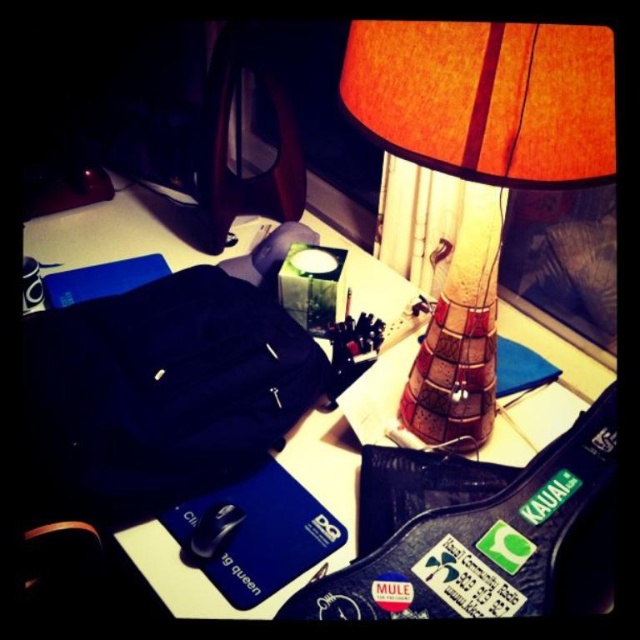
Does matte black backpack at center come behind white paper at upper center?

That is False.

Who is more distant from viewer, (x=236, y=339) or (x=384, y=417)?

Positioned behind is point (x=384, y=417).

This screenshot has height=640, width=640. What are the coordinates of `matte black backpack at center` in the screenshot? It's located at (164, 387).

Is point (433, 35) farther from viewer compared to point (102, 442)?

No, it is not.

Where is `orange fabric lampshade at upper right`? The height and width of the screenshot is (640, 640). orange fabric lampshade at upper right is located at coordinates (477, 170).

Which is behind, point (467, 369) or point (177, 476)?

Positioned behind is point (467, 369).

Where is `orange fabric lampshade at upper right`? This screenshot has height=640, width=640. orange fabric lampshade at upper right is located at coordinates click(477, 170).

Can you confirm if orange fabric lampshade at upper right is shorter than white paper at upper center?

Incorrect, orange fabric lampshade at upper right's height does not fall short of white paper at upper center's.

Describe the element at coordinates (477, 170) in the screenshot. This screenshot has height=640, width=640. I see `orange fabric lampshade at upper right` at that location.

Is point (502, 208) more distant than point (45, 230)?

No, (502, 208) is in front of (45, 230).

The height and width of the screenshot is (640, 640). In order to click on orange fabric lampshade at upper right in this screenshot , I will do `click(477, 170)`.